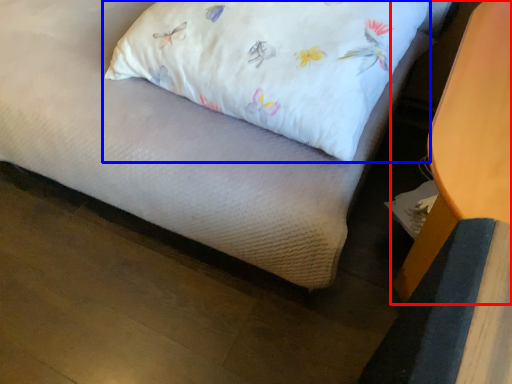
Question: Which point is closer to the camera, furniture (highlighted by a red box) or pillow (highlighted by a blue box)?

Choices:
 (A) furniture
 (B) pillow

Answer: (A)